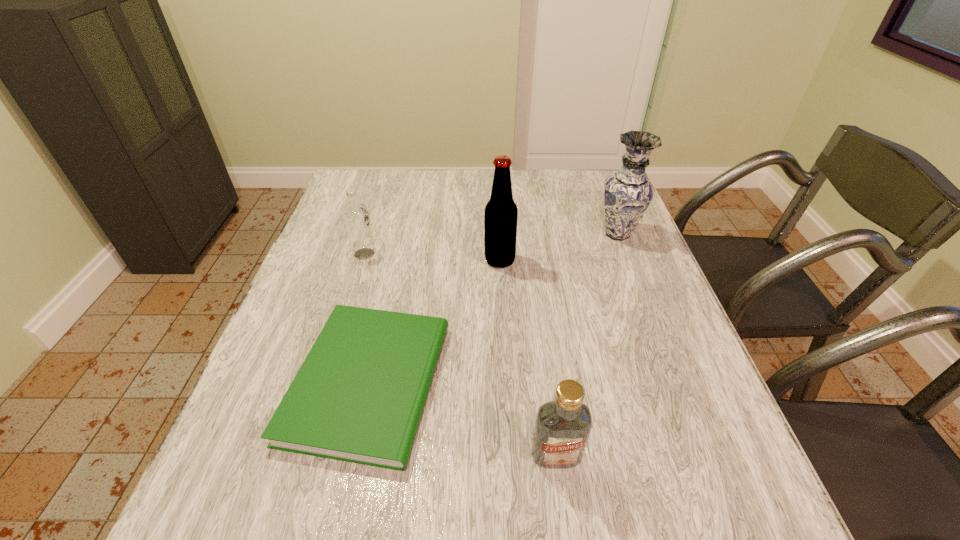
The height and width of the screenshot is (540, 960). I want to click on vodka situated at the left edge, so [x=356, y=217].

Locate an element on the screen. paperback book positioned at the left edge is located at coordinates (359, 396).

The height and width of the screenshot is (540, 960). What are the coordinates of `object at the right edge` in the screenshot? It's located at (628, 192).

Find the location of a particular element. The width and height of the screenshot is (960, 540). vacant space at the far edge of the desktop is located at coordinates (402, 201).

Find the location of a particular element. free space at the left edge of the desktop is located at coordinates (328, 301).

Find the location of `vacant area at the right edge`. vacant area at the right edge is located at coordinates (601, 213).

Identify the location of vacant area at the far left corner. (338, 204).

Locate an element on the screen. This screenshot has width=960, height=540. vacant space at the far right corner is located at coordinates (583, 172).

Image resolution: width=960 pixels, height=540 pixels. I want to click on free space between the vase and the shortest object, so click(492, 308).

Find the location of a particular element. free point between the beer bottle and the vase is located at coordinates (559, 247).